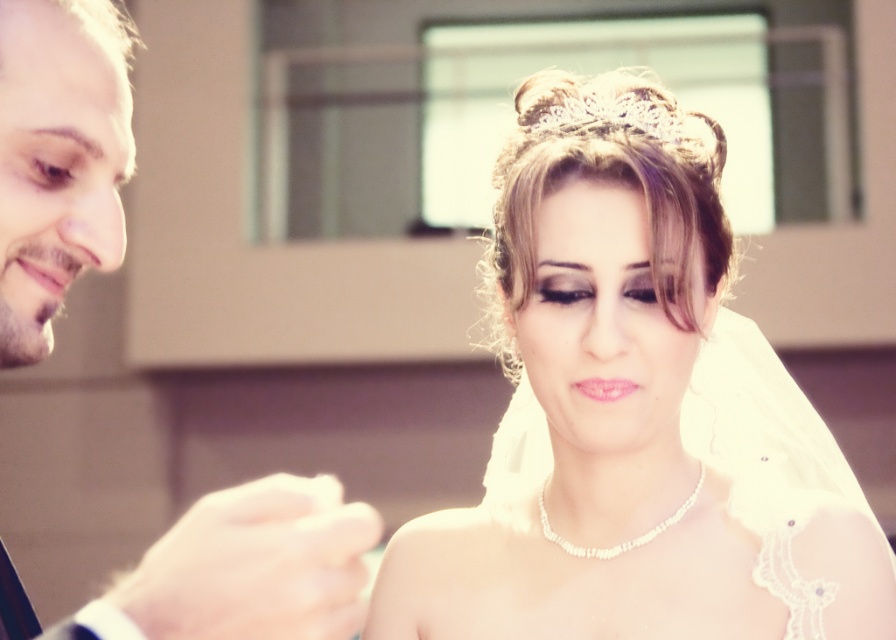
Question: Which point appears closest to the camera in this image?

Choices:
 (A) (11, 272)
 (B) (421, 531)

Answer: (A)

Question: Does smooth skin face at left appear over clear crystal tiara at upper center?

Choices:
 (A) no
 (B) yes

Answer: (A)

Question: Is ivory satin veil at upper center wider than clear crystal tiara at upper center?

Choices:
 (A) yes
 (B) no

Answer: (A)

Question: Which point appears closest to the camera in this image?

Choices:
 (A) (248, 566)
 (B) (672, 100)

Answer: (A)

Question: Considering the relative positions of smooth skin face at left and clear crystal tiara at upper center in the image provided, where is smooth skin face at left located with respect to clear crystal tiara at upper center?

Choices:
 (A) right
 (B) left

Answer: (B)

Question: Among these objects, which one is nearest to the camera?

Choices:
 (A) smooth skin face at left
 (B) clear crystal tiara at upper center

Answer: (A)